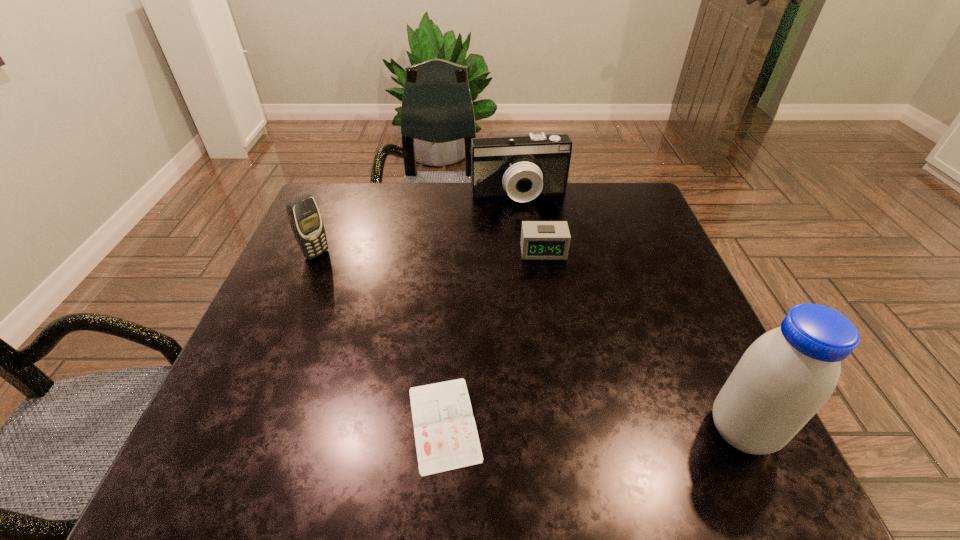
Locate an element on the screen. object present at the left edge is located at coordinates (305, 219).

Locate an element on the screen. This screenshot has height=540, width=960. object situated at the right edge is located at coordinates (784, 378).

Find the location of `object located in the near right corner section of the desktop`. object located in the near right corner section of the desktop is located at coordinates (784, 378).

Where is `vacant space at the far edge`? Image resolution: width=960 pixels, height=540 pixels. vacant space at the far edge is located at coordinates (444, 191).

Locate an element on the screen. This screenshot has width=960, height=540. free space at the near edge is located at coordinates (577, 389).

Where is `blank space at the left edge of the desktop`? This screenshot has height=540, width=960. blank space at the left edge of the desktop is located at coordinates (291, 300).

Where is `vacant space at the right edge of the desktop`? The height and width of the screenshot is (540, 960). vacant space at the right edge of the desktop is located at coordinates (655, 349).

You are a GUI agent. You are given a task and a screenshot of the screen. Output one action in this format:
    pyautogui.click(x=<x>, y=<y>)
    Task: Click on the free region at the far left corner of the desktop
    Image resolution: width=960 pixels, height=540 pixels.
    Given the screenshot: What is the action you would take?
    pyautogui.click(x=343, y=210)

You are a GUI agent. You are given a task and a screenshot of the screen. Output one action in this format:
    pyautogui.click(x=<x>, y=<y>)
    Task: Click on the free space between the shortest object and the rightmost object
    The height and width of the screenshot is (540, 960).
    Given the screenshot: What is the action you would take?
    pyautogui.click(x=593, y=427)

Identify the location of vacant area between the second shortest object and the soya milk. (642, 341).